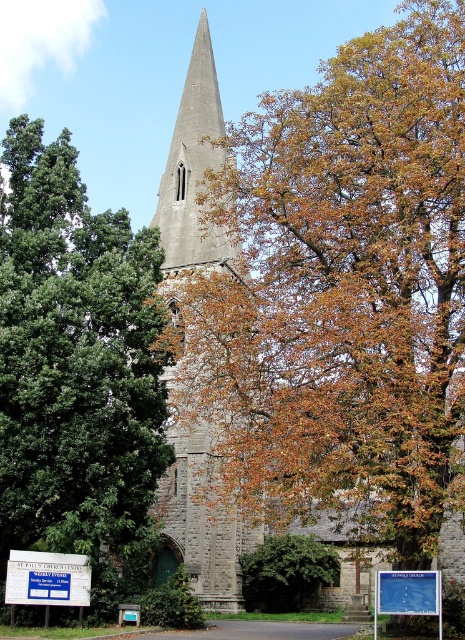
You are standing in front of the historic stone church and see the brown leafy tree at center and the green leafy tree at left. Which tree is closer to the left side of the image?

The green leafy tree at left is closer to the left side of the image because it is positioned on the left side of the brown leafy tree at center.

You are standing in front of the historic stone church and want to take a photo that includes both the brown leafy tree at center and the green leafy tree at left. Which tree should you position closer to the camera to ensure both are fully visible in the frame?

To ensure both the brown leafy tree at center and the green leafy tree at left are fully visible in the frame, position the green leafy tree at left closer to the camera since it is shorter than the brown leafy tree at center.

You are standing in front of the historic stone church and want to take a photo that includes both the green leafy tree at left and the brown textured tree at center. Which tree should you position closer to the left side of your camera frame to ensure both are visible?

To ensure both the green leafy tree at left and the brown textured tree at center are visible in your photo, position the green leafy tree at left to the left side of your camera frame since it is already located to the left of the brown textured tree at center.